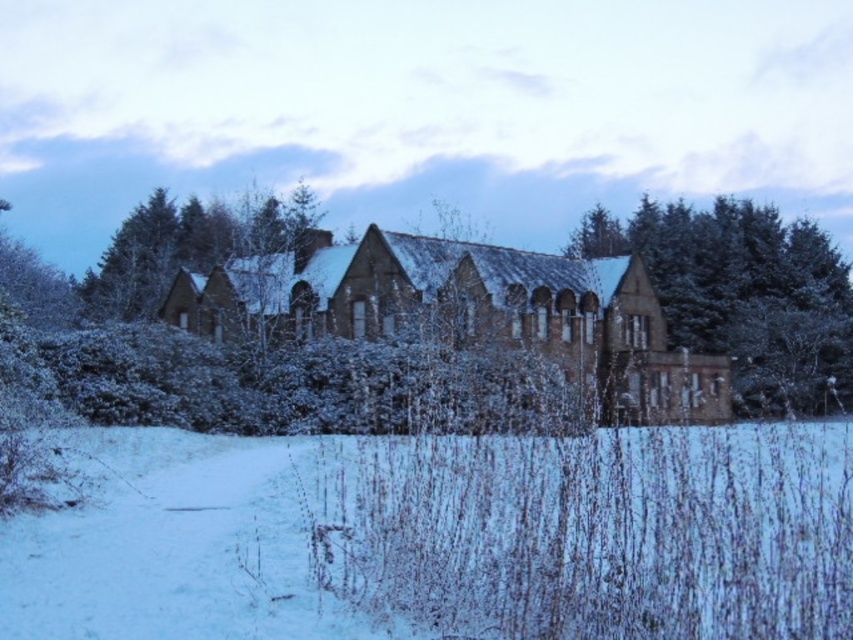
You are standing at the edge of the snow field and want to walk towards the brown stone church at center. Which direction should you move relative to the white fluffy snow at lower center?

You should move upward from the white fluffy snow at lower center towards the brown stone church at center since the white fluffy snow at lower center is located below the brown stone church at center.

You are standing in the winter scene and want to walk from the point closer to you to the point further away. Which path would you take between the two points, point (563,484) and point (782,230)?

The path from point (563,484) to point (782,230) would involve moving away from the viewer since point (563,484) is closer to you than point (782,230).

You are standing at the entrance of the old stone building and want to walk towards the point marked as point (167, 554). However, there is another point, point (352, 289), in your path. Based on the scene description, which point is closer to you as you start walking?

Point (167, 554) is in front of point (352, 289), so the point (167, 554) is closer to you as you start walking.